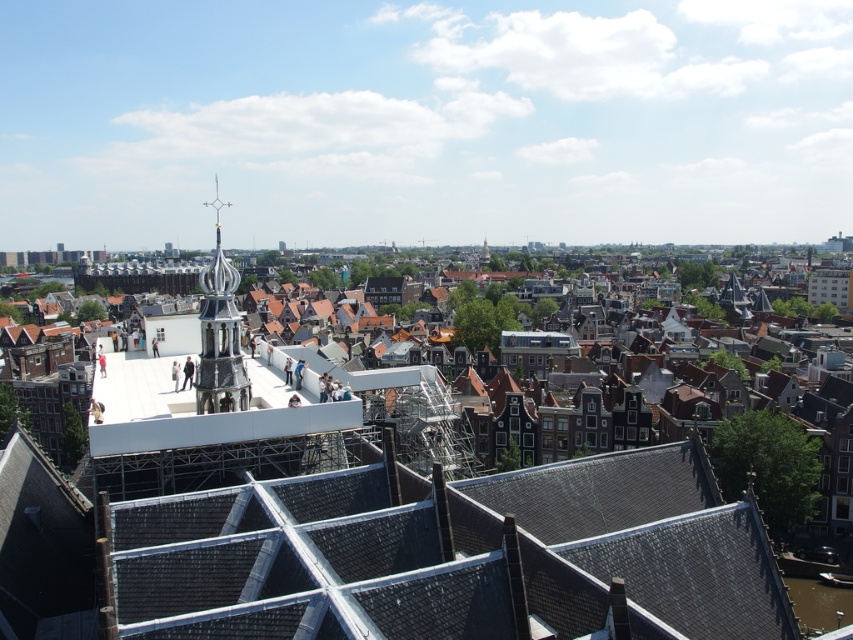
Between polished silver spire at center-left and polished silver spire at center, which one appears on the right side from the viewer's perspective?

polished silver spire at center is more to the right.

Does polished silver spire at center-left appear on the right side of polished silver spire at center?

Incorrect, polished silver spire at center-left is not on the right side of polished silver spire at center.

Does point (229, 384) lie in front of point (488, 250)?

Yes, it is.

At what (x,y) coordinates should I click in order to perform the action: click on polished silver spire at center-left. Please return your answer as a coordinate pair (x, y). Image resolution: width=853 pixels, height=640 pixels. Looking at the image, I should click on (219, 333).